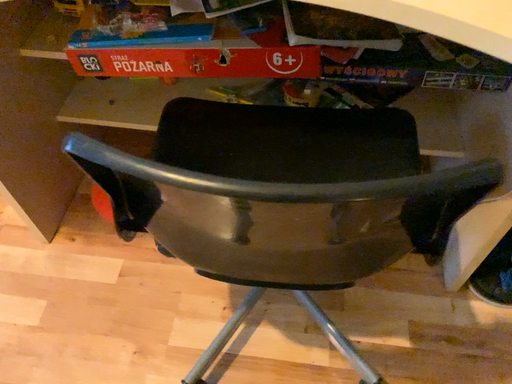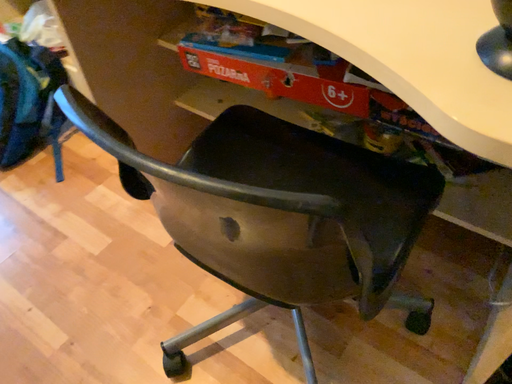
Question: How did the camera likely rotate when shooting the video?

Choices:
 (A) rotated right
 (B) rotated left

Answer: (B)